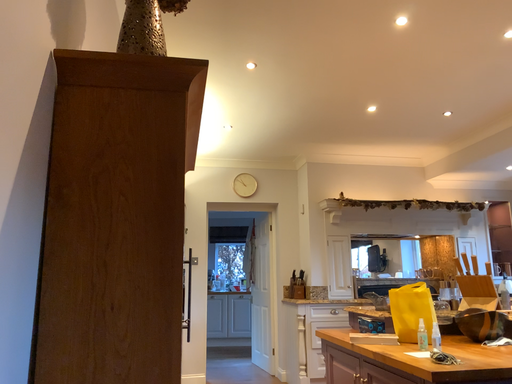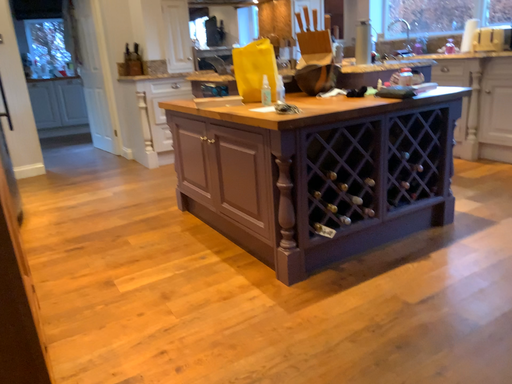
Question: How did the camera likely rotate when shooting the video?

Choices:
 (A) rotated upward
 (B) rotated downward

Answer: (B)